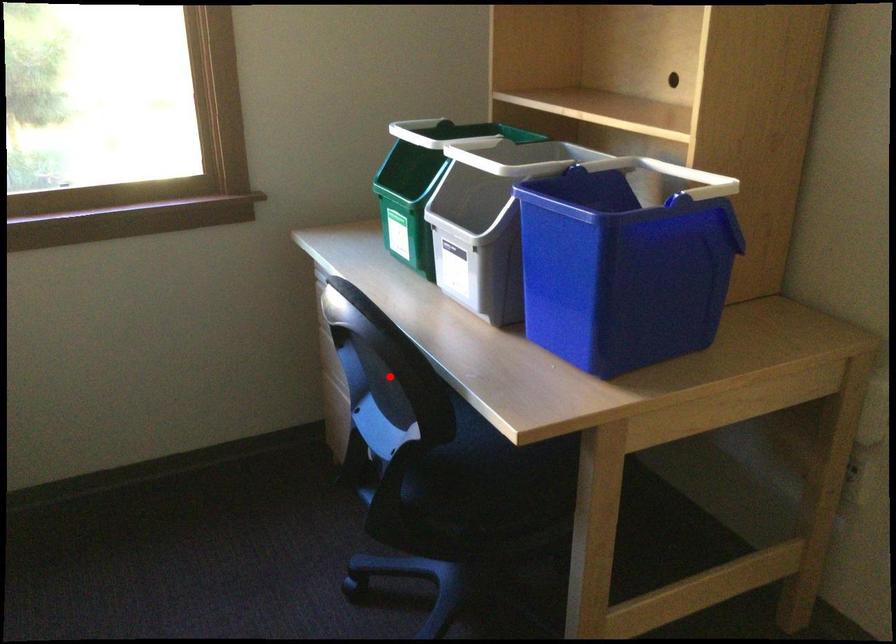
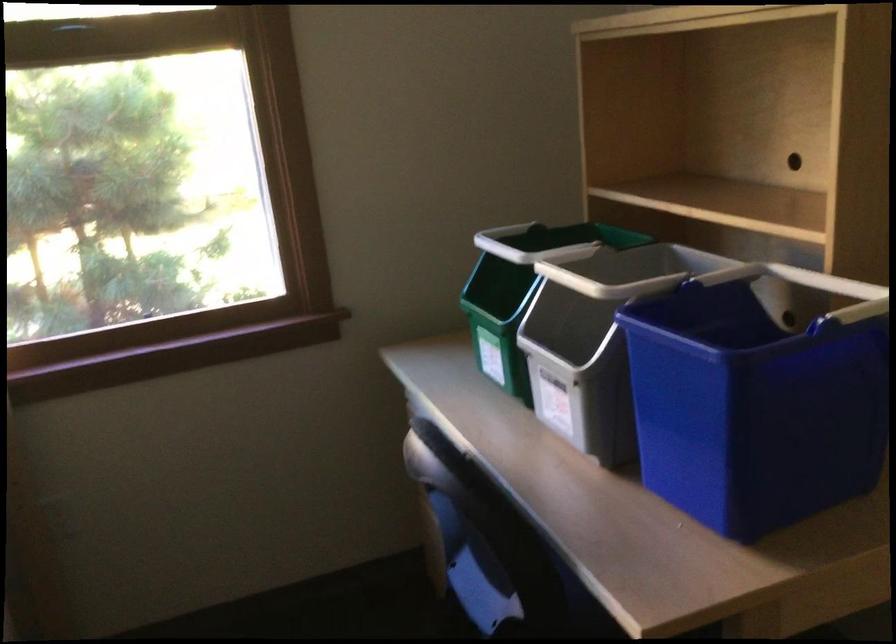
Question: I am providing you with two images of the same scene from different viewpoints. In image1, a red point is highlighted. Considering the same 3D point in image2, which of the following is correct?

Choices:
 (A) It is closer
 (B) It is farther

Answer: (A)